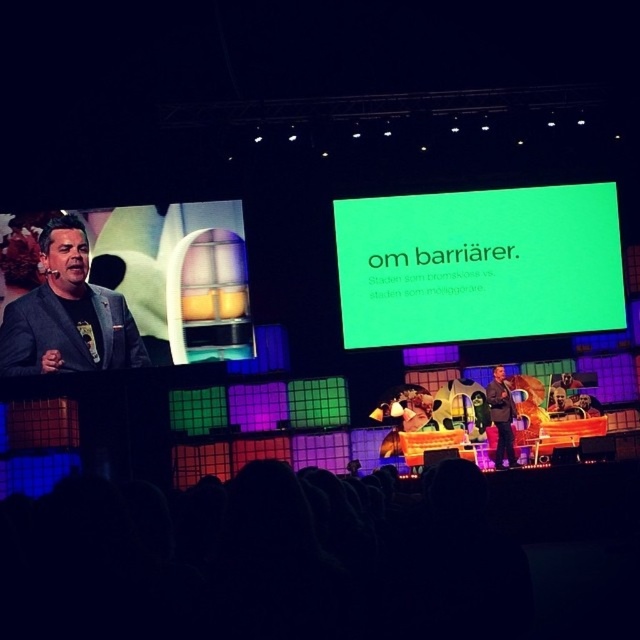
Question: Among these points, which one is nearest to the camera?

Choices:
 (A) (124, 342)
 (B) (508, 454)
 (C) (394, 342)

Answer: (B)

Question: Is the position of black matte suit at left more distant than that of dark brown suit at center?

Choices:
 (A) yes
 (B) no

Answer: (A)

Question: Which point is farther to the camera?

Choices:
 (A) click(x=552, y=225)
 (B) click(x=502, y=410)

Answer: (A)

Question: Which point appears closest to the camera in this image?

Choices:
 (A) (497, 440)
 (B) (356, 256)
 (C) (99, 323)

Answer: (A)

Question: Is green matte projection screen at upper center wider than dark brown suit at center?

Choices:
 (A) yes
 (B) no

Answer: (A)

Question: Where is black matte suit at left located in relation to dark brown suit at center in the image?

Choices:
 (A) left
 (B) right

Answer: (A)